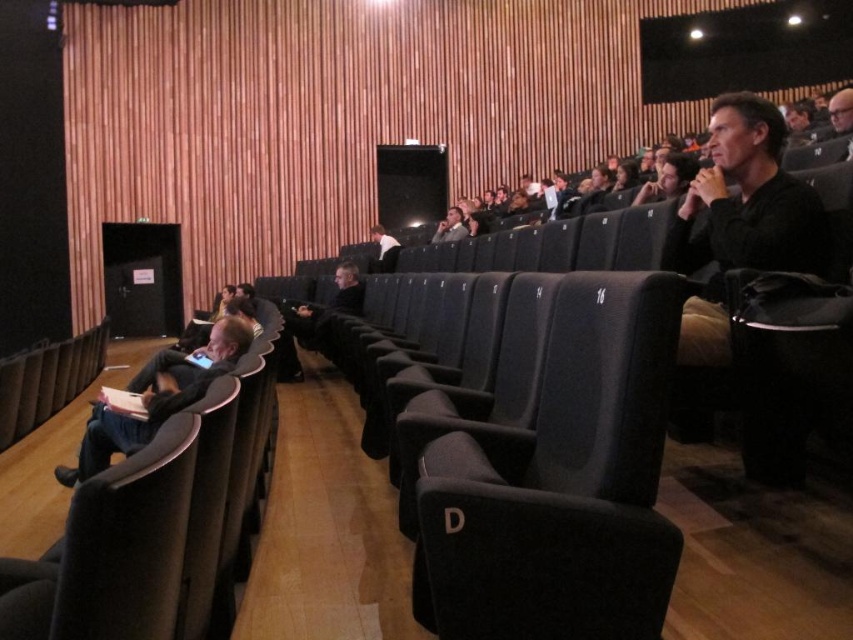
You are organizing a small event in the auditorium and need to place a black matte jacket at upper right on a dark gray fabric seat at center. Will the jacket fit on the seat?

The dark gray fabric seat at center has a lesser width compared to the black matte jacket at upper right, so the jacket may not fit properly on the seat.

Looking at this image, you are sitting in the auditorium and want to locate two specific points marked on the floor. The first point is at coordinates point [463,516] and the second is at point [722,253]. Which point is closer to your current position as you look towards the stage?

Point [463,516] is closer to the viewer than point [722,253], so the first point is closer.

You are attending a lecture in this auditorium and notice two items in front of you. One is a dark gray fabric seat at center and the other is a dark gray fabric jacket at left. Which item is shorter in height?

The dark gray fabric seat at center is not as tall as the dark gray fabric jacket at left, so the seat is shorter in height.